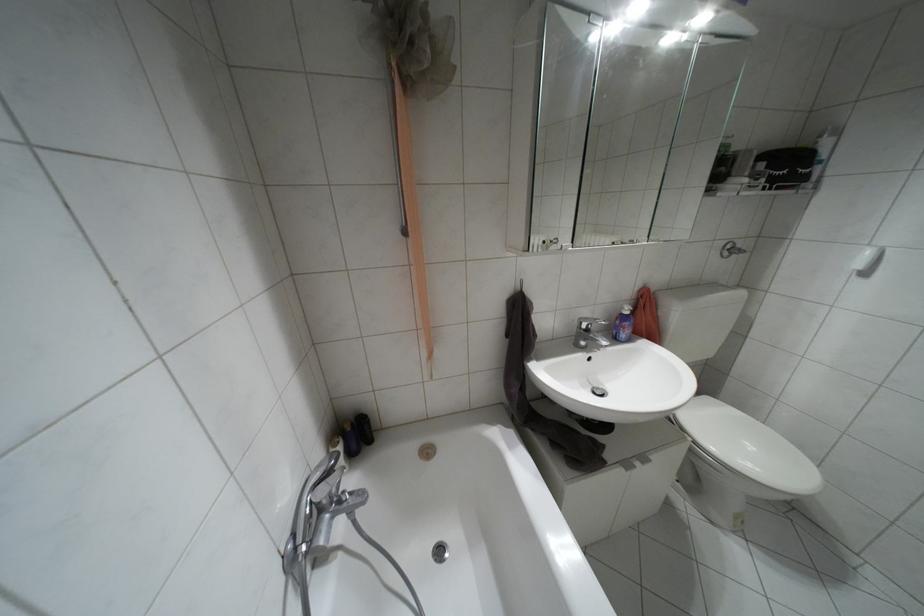
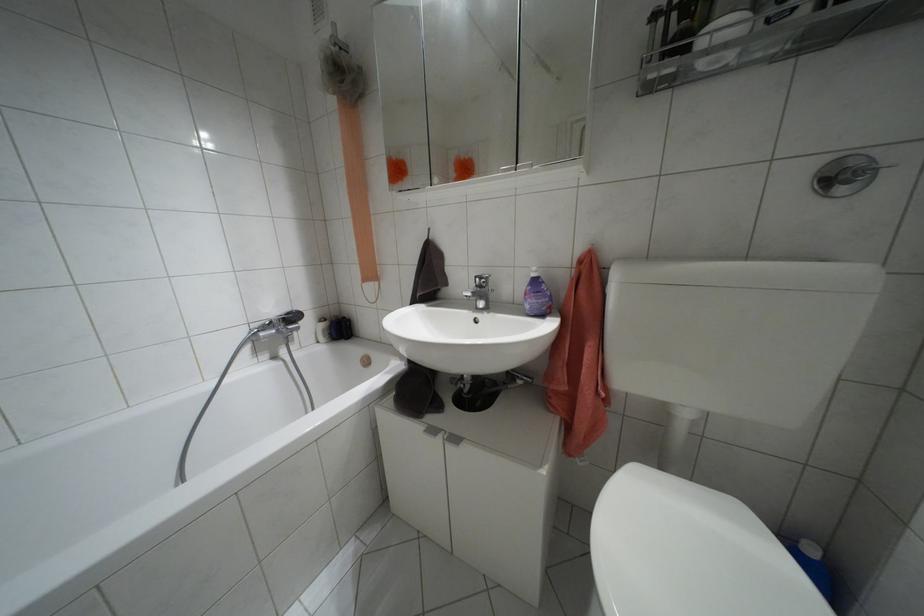
Find the pixel in the second image that matches [642,458] in the first image.

(455, 439)